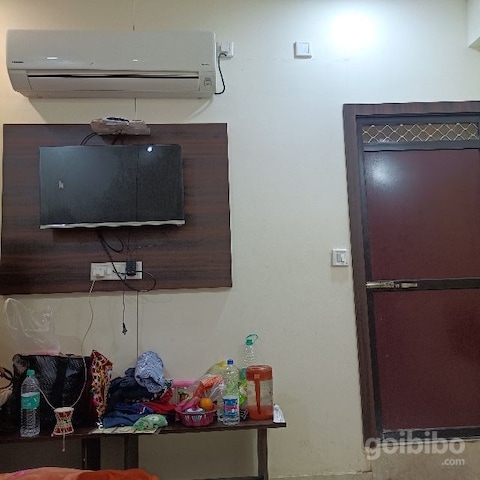
Find the location of a particular element. This screenshot has height=480, width=480. light switches is located at coordinates (339, 258), (344, 259).